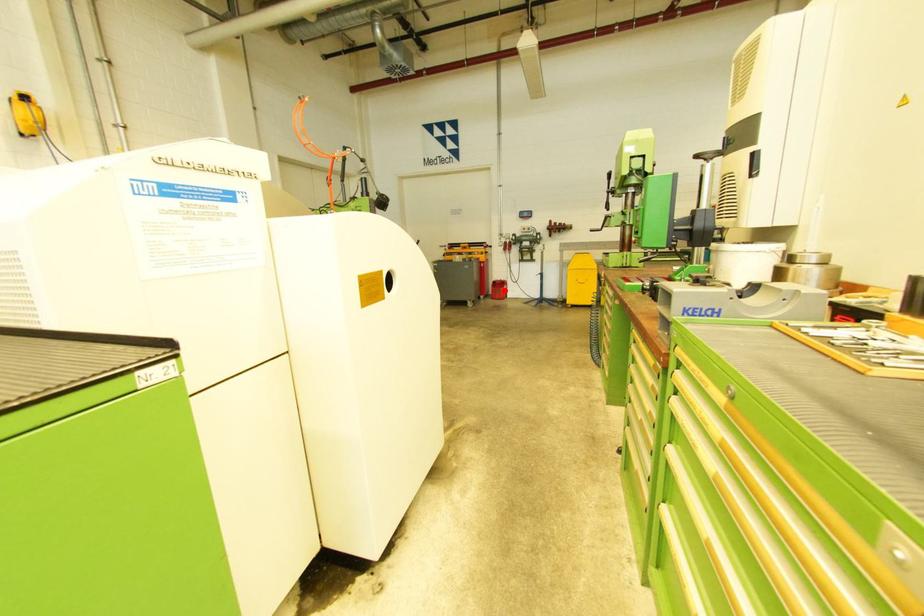
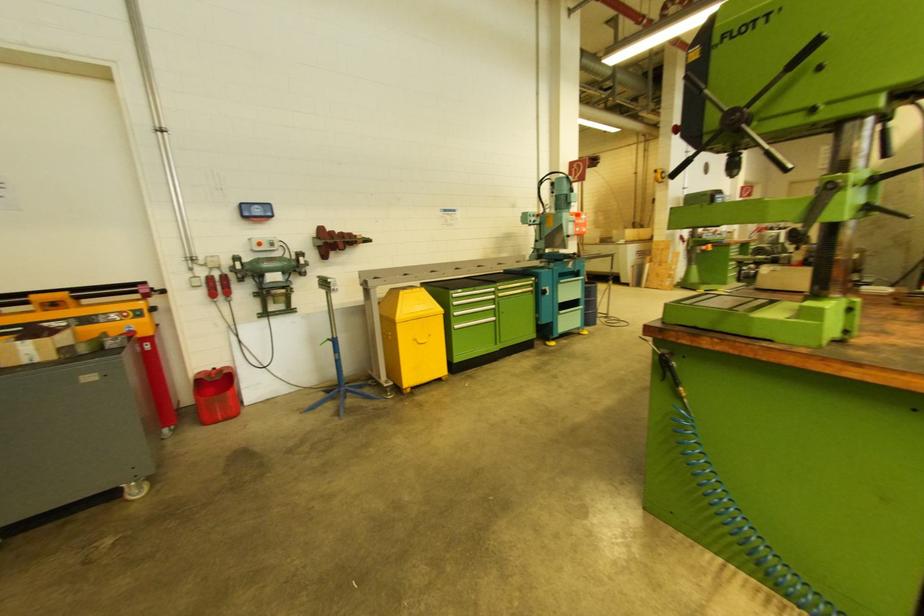
Question: I am providing you with two images of the same scene from different viewpoints. In image1, a red point is highlighted. Considering the same 3D point in image2, which of the following is correct?

Choices:
 (A) It is closer
 (B) It is farther

Answer: (B)